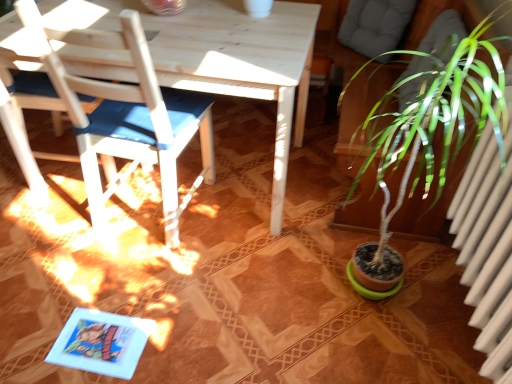
Describe the element at coordinates (22, 114) in the screenshot. I see `white wood chair at left, arranged as the second chair when viewed from the right` at that location.

At what (x,y) coordinates should I click in order to perform the action: click on white wood chair at left, the first chair viewed from the left. Please return your answer as a coordinate pair (x, y). This screenshot has height=384, width=512. Looking at the image, I should click on (22, 114).

The width and height of the screenshot is (512, 384). What do you see at coordinates (127, 115) in the screenshot? I see `white wood chair at left, which is counted as the second chair, starting from the left` at bounding box center [127, 115].

Locate an element on the screen. white wood chair at left, arranged as the first chair when viewed from the right is located at coordinates (127, 115).

Identify the location of white wood chair at left, the first chair viewed from the left. Image resolution: width=512 pixels, height=384 pixels. 22,114.

Considering the relative positions of white wood chair at left, arranged as the first chair when viewed from the right, and white wood chair at left, the first chair viewed from the left, in the image provided, is white wood chair at left, arranged as the first chair when viewed from the right, to the right of white wood chair at left, the first chair viewed from the left, from the viewer's perspective?

Yes, white wood chair at left, arranged as the first chair when viewed from the right, is to the right of white wood chair at left, the first chair viewed from the left.

Is white wood chair at left, arranged as the first chair when viewed from the right, further to camera compared to white wood chair at left, arranged as the second chair when viewed from the right?

No.

Which point is more forward, (81,157) or (20,155)?

The point (20,155) is closer.

From the image's perspective, would you say white wood chair at left, which is counted as the second chair, starting from the left, is shown under white wood chair at left, the first chair viewed from the left?

Yes.

From a real-world perspective, is white wood chair at left, which is counted as the second chair, starting from the left, on top of white wood chair at left, the first chair viewed from the left?

Yes, from a real-world perspective, white wood chair at left, which is counted as the second chair, starting from the left, is on top of white wood chair at left, the first chair viewed from the left.

Considering the sizes of objects white wood chair at left, which is counted as the second chair, starting from the left, and white wood chair at left, the first chair viewed from the left, in the image provided, who is wider, white wood chair at left, which is counted as the second chair, starting from the left, or white wood chair at left, the first chair viewed from the left,?

With larger width is white wood chair at left, the first chair viewed from the left.

Who is taller, white wood chair at left, arranged as the first chair when viewed from the right, or white wood chair at left, arranged as the second chair when viewed from the right?

white wood chair at left, arranged as the first chair when viewed from the right.

Who is smaller, white wood chair at left, which is counted as the second chair, starting from the left, or white wood chair at left, the first chair viewed from the left?

white wood chair at left, the first chair viewed from the left, is smaller.

Would you say white wood chair at left, the first chair viewed from the left, is part of white wood chair at left, arranged as the first chair when viewed from the right,'s contents?

No, white wood chair at left, the first chair viewed from the left, is located outside of white wood chair at left, arranged as the first chair when viewed from the right.

Is white wood chair at left, which is counted as the second chair, starting from the left, positioned with its back to white wood chair at left, the first chair viewed from the left?

white wood chair at left, which is counted as the second chair, starting from the left, does not have its back to white wood chair at left, the first chair viewed from the left.

Can you tell me how much white wood chair at left, arranged as the first chair when viewed from the right, and white wood chair at left, arranged as the second chair when viewed from the right, differ in facing direction?

The facing directions of white wood chair at left, arranged as the first chair when viewed from the right, and white wood chair at left, arranged as the second chair when viewed from the right, are 83.8 degrees apart.

How distant is white wood chair at left, arranged as the first chair when viewed from the right, from white wood chair at left, the first chair viewed from the left?

white wood chair at left, arranged as the first chair when viewed from the right, is 19.38 inches from white wood chair at left, the first chair viewed from the left.

I want to click on chair to the left of white wood chair at left, which is counted as the second chair, starting from the left, so click(x=22, y=114).

Would you say white wood chair at left, the first chair viewed from the left, is to the left or to the right of white wood chair at left, arranged as the first chair when viewed from the right, in the picture?

In the image, white wood chair at left, the first chair viewed from the left, appears on the left side of white wood chair at left, arranged as the first chair when viewed from the right.

Is the depth of white wood chair at left, arranged as the second chair when viewed from the right, greater than that of white wood chair at left, arranged as the first chair when viewed from the right?

Yes.

Considering the positions of points (27, 86) and (214, 172), is point (27, 86) closer to camera compared to point (214, 172)?

Yes, it is.

From the image's perspective, would you say white wood chair at left, arranged as the second chair when viewed from the right, is shown under white wood chair at left, which is counted as the second chair, starting from the left?

No.

From a real-world perspective, who is located higher, white wood chair at left, arranged as the second chair when viewed from the right, or white wood chair at left, arranged as the first chair when viewed from the right?

white wood chair at left, arranged as the first chair when viewed from the right.

Is white wood chair at left, the first chair viewed from the left, thinner than white wood chair at left, which is counted as the second chair, starting from the left?

Incorrect, the width of white wood chair at left, the first chair viewed from the left, is not less than that of white wood chair at left, which is counted as the second chair, starting from the left.

Considering the sizes of white wood chair at left, the first chair viewed from the left, and white wood chair at left, which is counted as the second chair, starting from the left, in the image, is white wood chair at left, the first chair viewed from the left, taller or shorter than white wood chair at left, which is counted as the second chair, starting from the left,?

white wood chair at left, the first chair viewed from the left, is shorter than white wood chair at left, which is counted as the second chair, starting from the left.

Is white wood chair at left, the first chair viewed from the left, bigger or smaller than white wood chair at left, arranged as the first chair when viewed from the right?

Clearly, white wood chair at left, the first chair viewed from the left, is smaller in size than white wood chair at left, arranged as the first chair when viewed from the right.

Is white wood chair at left, arranged as the second chair when viewed from the right, inside or outside of white wood chair at left, which is counted as the second chair, starting from the left?

white wood chair at left, arranged as the second chair when viewed from the right, exists outside the volume of white wood chair at left, which is counted as the second chair, starting from the left.

Is white wood chair at left, the first chair viewed from the left, not near white wood chair at left, which is counted as the second chair, starting from the left?

No, white wood chair at left, the first chair viewed from the left, is not far from white wood chair at left, which is counted as the second chair, starting from the left.

Is white wood chair at left, the first chair viewed from the left, oriented towards white wood chair at left, which is counted as the second chair, starting from the left?

No, white wood chair at left, the first chair viewed from the left, is not facing towards white wood chair at left, which is counted as the second chair, starting from the left.

What's the angular difference between white wood chair at left, arranged as the second chair when viewed from the right, and white wood chair at left, arranged as the first chair when viewed from the right,'s facing directions?

83.8 degrees.

Measure the distance between white wood chair at left, arranged as the second chair when viewed from the right, and white wood chair at left, arranged as the first chair when viewed from the right.

white wood chair at left, arranged as the second chair when viewed from the right, is 49.23 centimeters away from white wood chair at left, arranged as the first chair when viewed from the right.

Identify the location of chair lying on the right of white wood chair at left, arranged as the second chair when viewed from the right. (127, 115).

At what (x,y) coordinates should I click in order to perform the action: click on chair above the white wood chair at left, arranged as the second chair when viewed from the right (from a real-world perspective). Please return your answer as a coordinate pair (x, y). This screenshot has height=384, width=512. Looking at the image, I should click on (127, 115).

You are a GUI agent. You are given a task and a screenshot of the screen. Output one action in this format:
    pyautogui.click(x=<x>, y=<y>)
    Task: Click on the chair in front of the white wood chair at left, the first chair viewed from the left
    
    Given the screenshot: What is the action you would take?
    pyautogui.click(x=127, y=115)